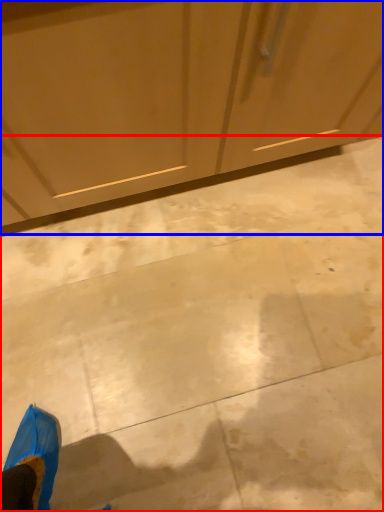
Question: Which object is closer to the camera taking this photo, concrete (highlighted by a red box) or dresser (highlighted by a blue box)?

Choices:
 (A) concrete
 (B) dresser

Answer: (B)